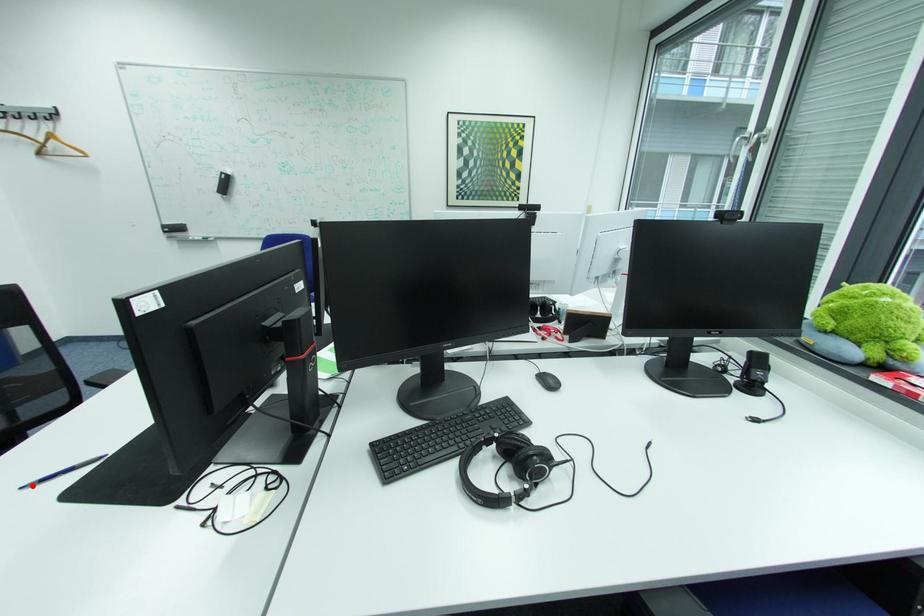
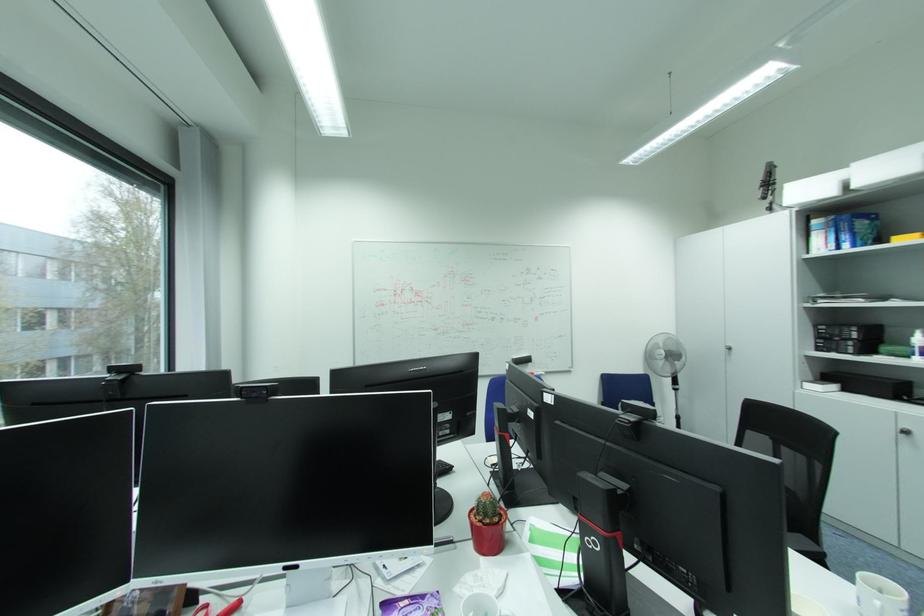
Question: I am providing you with two images of the same scene from different viewpoints. A red point is marked on the first image. At the location where the point appears in image 1, is it still visible in image 2?

Choices:
 (A) Yes
 (B) No

Answer: (B)